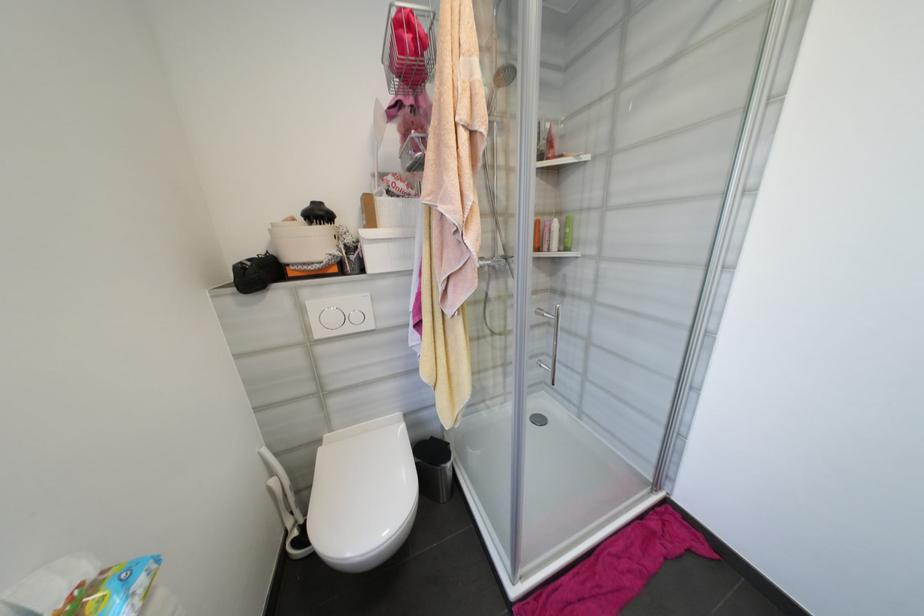
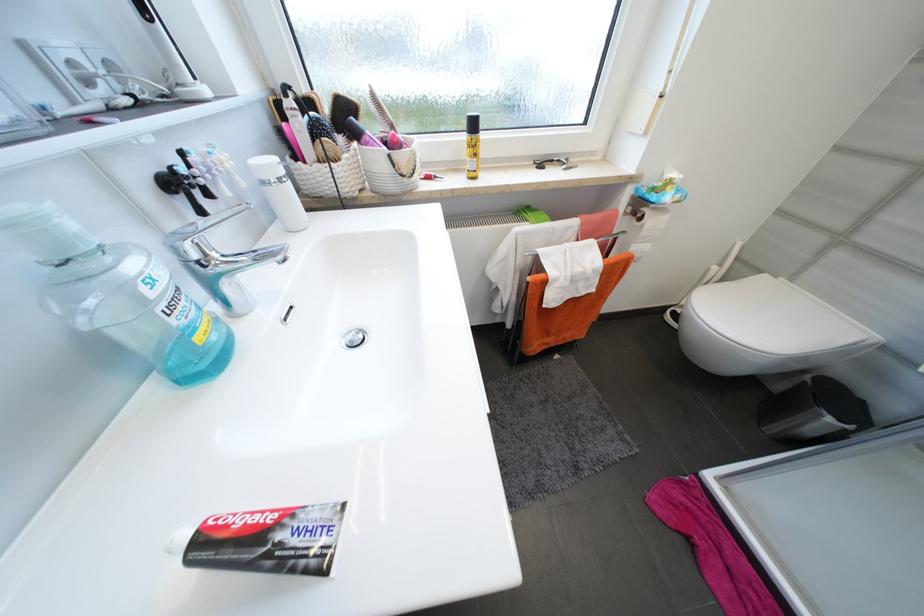
Find the pixel in the second image that matches (594,586) in the first image.

(759, 596)